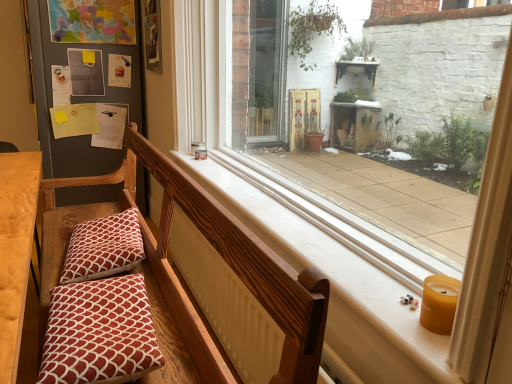
Question: Is wooden church bench at center next to wooden bench cushion at left and touching it?

Choices:
 (A) no
 (B) yes

Answer: (A)

Question: Does wooden church bench at center appear on the left side of wooden bench cushion at left?

Choices:
 (A) yes
 (B) no

Answer: (B)

Question: Is the position of wooden church bench at center more distant than that of wooden bench cushion at left?

Choices:
 (A) no
 (B) yes

Answer: (A)

Question: Is wooden church bench at center outside of wooden bench cushion at left?

Choices:
 (A) no
 (B) yes

Answer: (B)

Question: Does wooden church bench at center have a greater height compared to wooden bench cushion at left?

Choices:
 (A) yes
 (B) no

Answer: (A)

Question: Does wooden church bench at center have a larger size compared to wooden bench cushion at left?

Choices:
 (A) yes
 (B) no

Answer: (A)

Question: From a real-world perspective, is smooth white window sill at center beneath patterned fabric pillow at lower left, which ranks as the second pillow in front-to-back order?

Choices:
 (A) no
 (B) yes

Answer: (A)

Question: Considering the relative sizes of smooth white window sill at center and patterned fabric pillow at lower left, placed as the 1th pillow when sorted from back to front, in the image provided, is smooth white window sill at center taller than patterned fabric pillow at lower left, placed as the 1th pillow when sorted from back to front,?

Choices:
 (A) yes
 (B) no

Answer: (A)

Question: Can you confirm if smooth white window sill at center is smaller than patterned fabric pillow at lower left, which ranks as the second pillow in front-to-back order?

Choices:
 (A) no
 (B) yes

Answer: (A)

Question: Does smooth white window sill at center have a larger size compared to patterned fabric pillow at lower left, placed as the 1th pillow when sorted from back to front?

Choices:
 (A) no
 (B) yes

Answer: (B)

Question: From a real-world perspective, is smooth white window sill at center physically above patterned fabric pillow at lower left, which ranks as the second pillow in front-to-back order?

Choices:
 (A) yes
 (B) no

Answer: (A)

Question: Is smooth white window sill at center not within patterned fabric pillow at lower left, placed as the 1th pillow when sorted from back to front?

Choices:
 (A) yes
 (B) no

Answer: (A)

Question: Are wooden church bench at center and yellow wax candle at lower right beside each other?

Choices:
 (A) yes
 (B) no

Answer: (B)